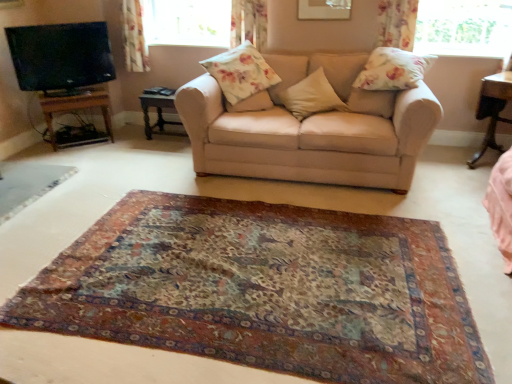
The image size is (512, 384). Find the location of `vacant space situated on the left part of wooden table at right, the first table positioned from the right`. vacant space situated on the left part of wooden table at right, the first table positioned from the right is located at coordinates (456, 167).